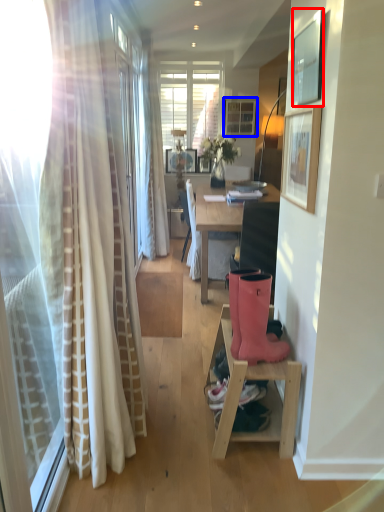
Question: Which of the following is the farthest to the observer, picture frame (highlighted by a red box) or picture frame (highlighted by a blue box)?

Choices:
 (A) picture frame
 (B) picture frame

Answer: (B)